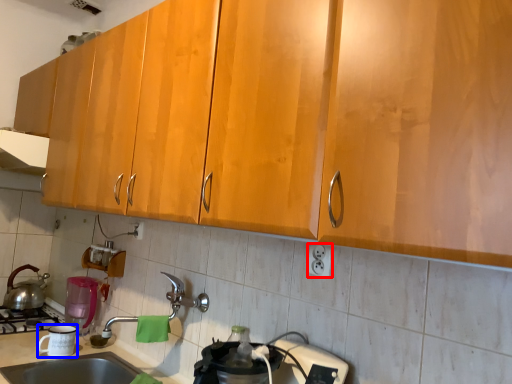
Question: Which point is closer to the camera, electric outlet (highlighted by a red box) or appliance (highlighted by a blue box)?

Choices:
 (A) electric outlet
 (B) appliance

Answer: (A)